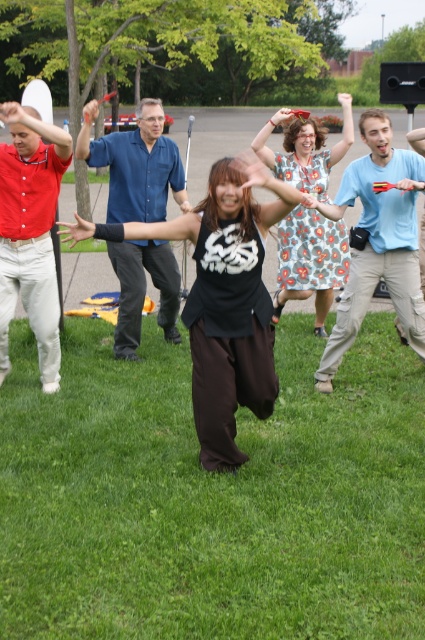
You are standing in the park and see the green grass at center and the black matte shirt at center. Which object is located to the left?

The green grass at center is positioned on the left side of black matte shirt at center.